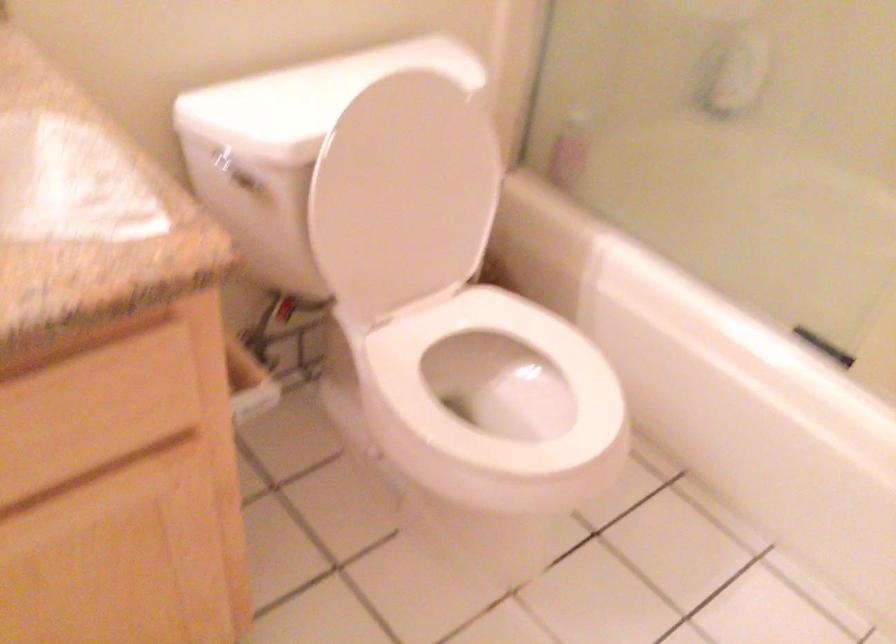
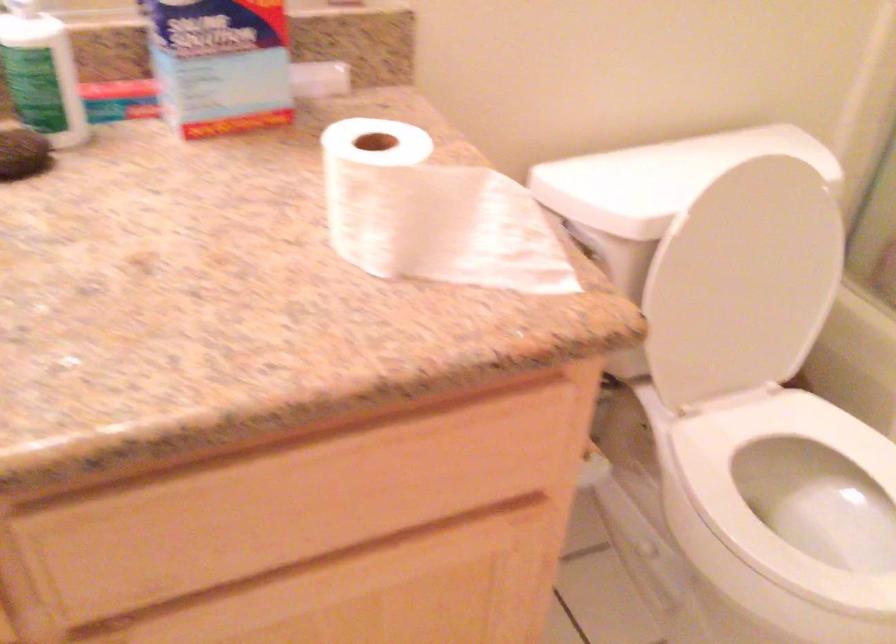
Question: In a continuous first-person perspective shot, in which direction is the camera moving?

Choices:
 (A) Left
 (B) Right
 (C) Forward
 (D) Backward

Answer: (A)